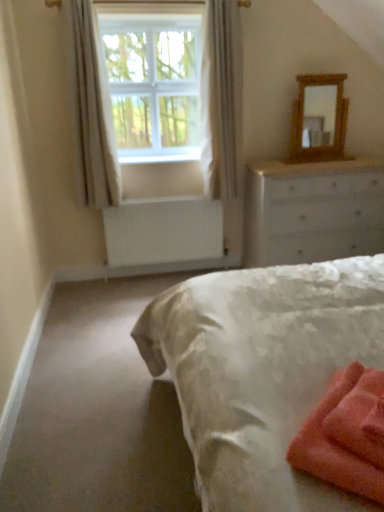
Question: Considering the positions of point (193, 150) and point (344, 104), is point (193, 150) closer or farther from the camera than point (344, 104)?

Choices:
 (A) farther
 (B) closer

Answer: (A)

Question: Do you think white painted wood at lower center is within wooden mirror at upper right, or outside of it?

Choices:
 (A) outside
 (B) inside

Answer: (A)

Question: Which of these objects is positioned closest to the white painted wood at lower center?

Choices:
 (A) white sheer curtain at upper left, arranged as the 1th curtain when viewed from the left
 (B) white painted wood chest of drawers at upper right
 (C) white sheer curtain at upper left, which is counted as the second curtain, starting from the left
 (D) soft coral towel at lower right
 (E) white plastic window screen at upper center

Answer: (C)

Question: Estimate the real-world distances between objects in this image. Which object is farther from the white painted wood at lower center?

Choices:
 (A) white sheer curtain at upper left, arranged as the 1th curtain when viewed from the left
 (B) wooden mirror at upper right
 (C) white sheer curtain at upper left, marked as the 1th curtain in a right-to-left arrangement
 (D) white painted wood chest of drawers at upper right
 (E) soft coral towel at lower right

Answer: (E)